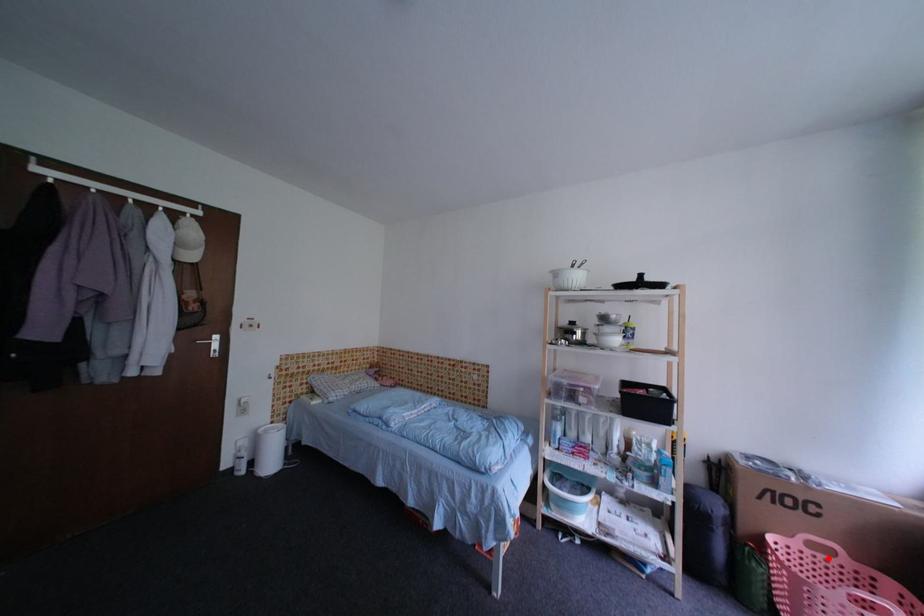
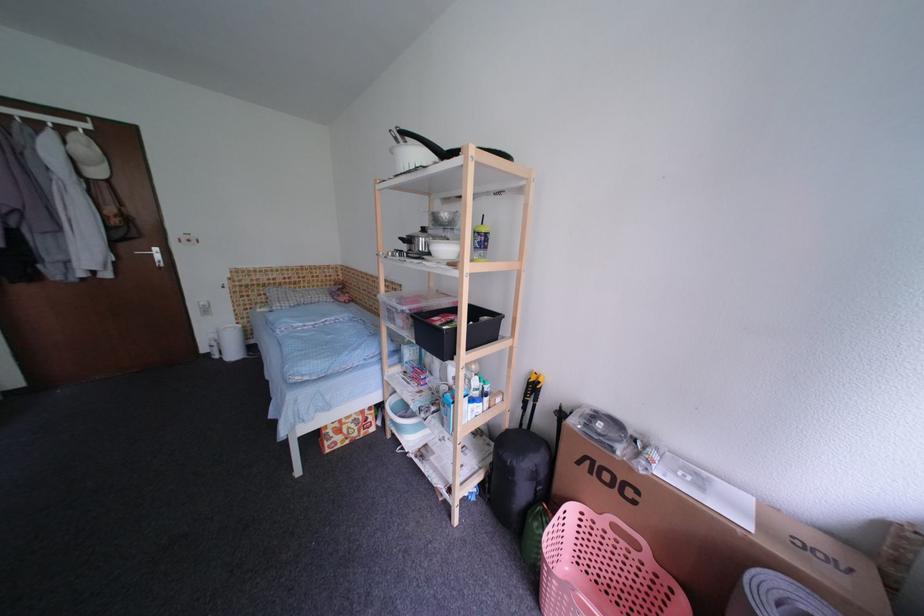
Locate, in the second image, the point that corresponds to the highlighted location in the first image.

(630, 546)